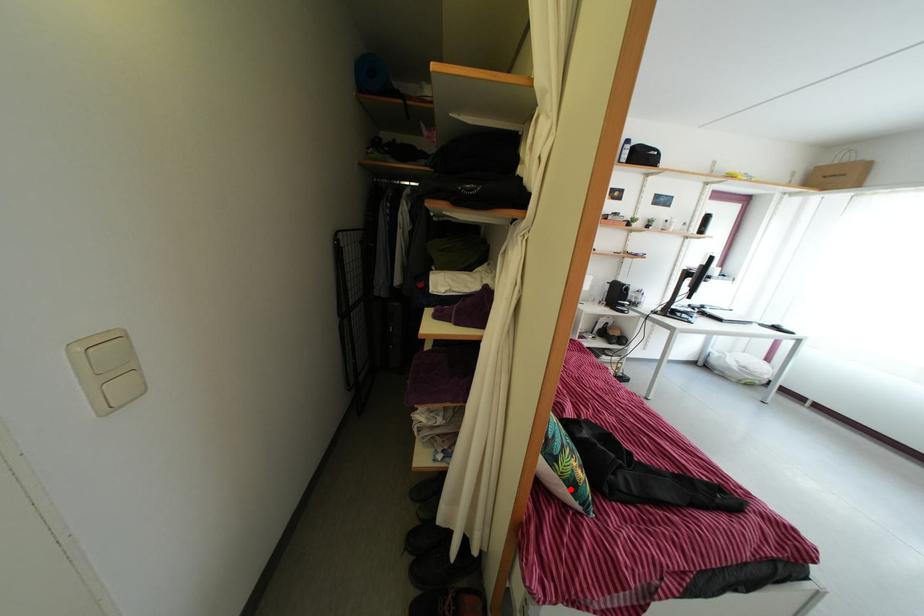
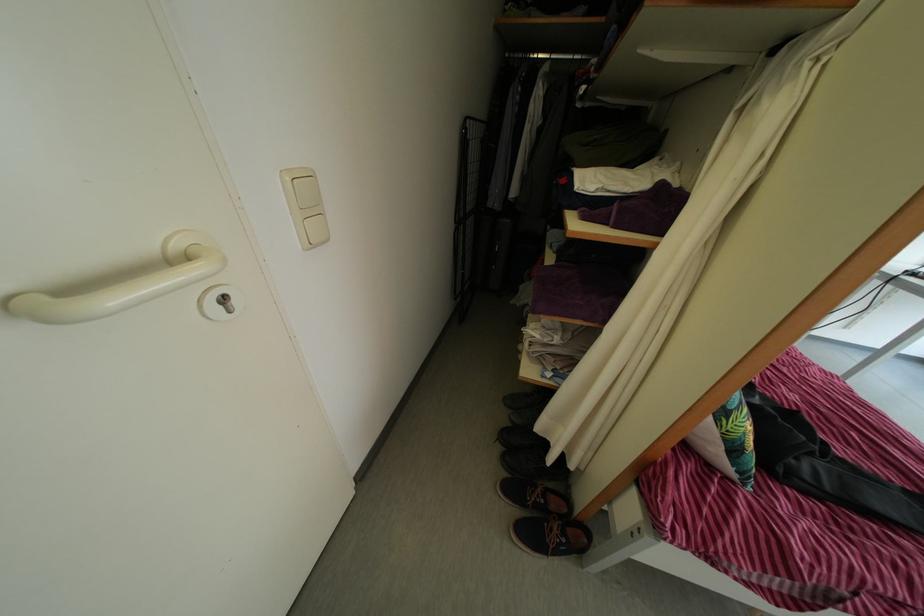
Question: I am providing you with two images of the same scene from different viewpoints. A red point is shown in image1. For the corresponding object point in image2, is it positioned nearer or farther from the camera?

Choices:
 (A) Nearer
 (B) Farther

Answer: (A)